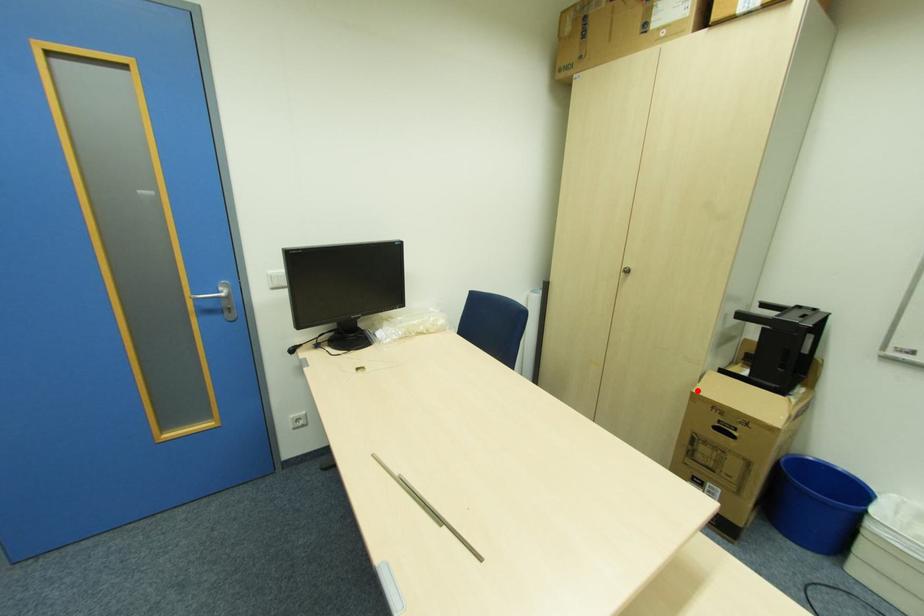
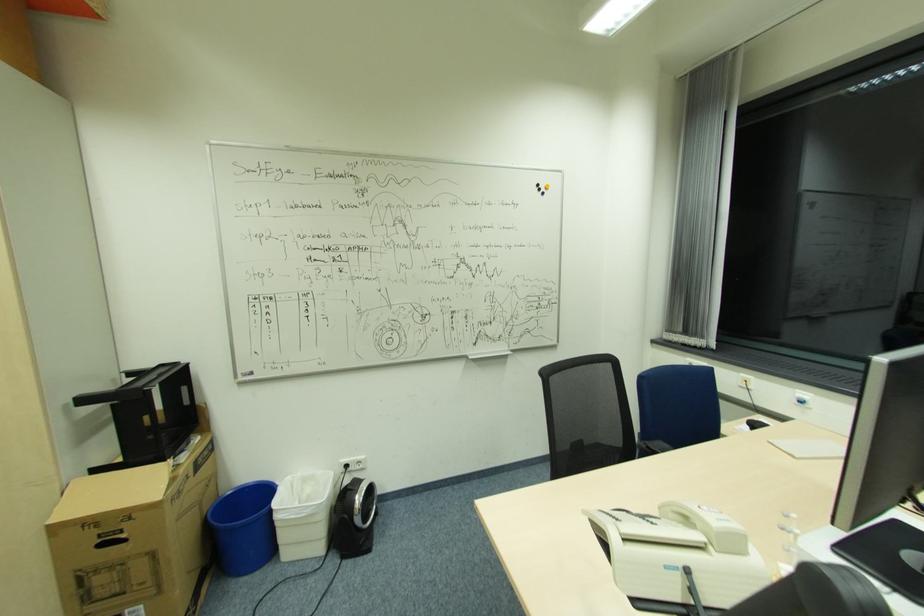
Where in the second image is the point corresponding to the highlighted location from the first image?

(51, 522)